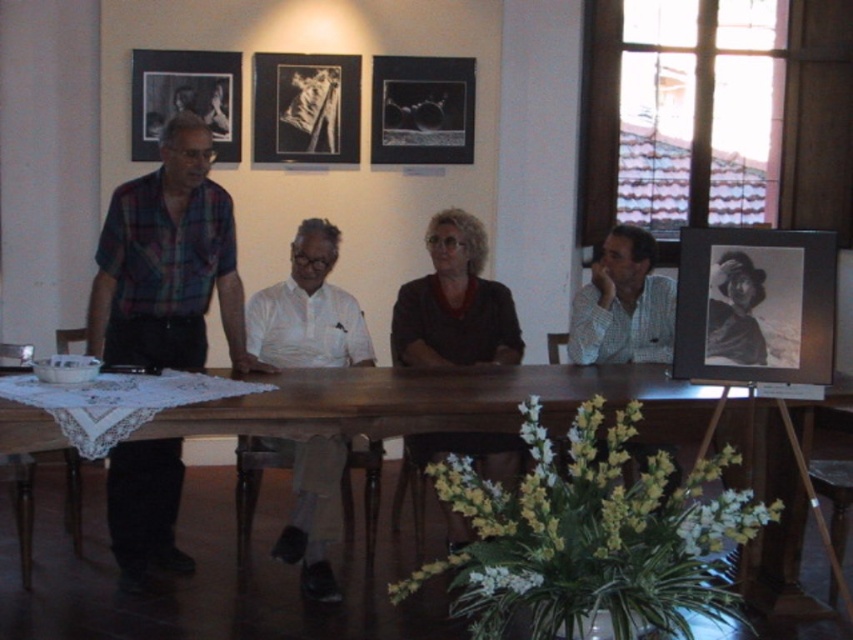
Does checkered fabric shirt at right have a smaller size compared to black matte picture frame at upper left?

Incorrect, checkered fabric shirt at right is not smaller in size than black matte picture frame at upper left.

Is checkered fabric shirt at right positioned behind black matte picture frame at upper left?

No, it is not.

What do you see at coordinates (624, 305) in the screenshot? The width and height of the screenshot is (853, 640). I see `checkered fabric shirt at right` at bounding box center [624, 305].

The image size is (853, 640). Find the location of `checkered fabric shirt at right`. checkered fabric shirt at right is located at coordinates (624, 305).

What do you see at coordinates (440, 401) in the screenshot? The height and width of the screenshot is (640, 853). I see `wooden table at center` at bounding box center [440, 401].

Who is taller, wooden table at center or checkered fabric shirt at right?

wooden table at center

Between point (403, 422) and point (630, 298), which one is positioned in front?

Point (403, 422) is more forward.

You are a GUI agent. You are given a task and a screenshot of the screen. Output one action in this format:
    pyautogui.click(x=<x>, y=<y>)
    Task: Click on the wooden table at center
    This screenshot has width=853, height=640.
    Given the screenshot: What is the action you would take?
    pyautogui.click(x=440, y=401)

Is white cotton shirt at center further to the viewer compared to black glossy picture frame at upper center?

No, it is in front of black glossy picture frame at upper center.

Is point (370, 348) closer to camera compared to point (381, 84)?

Yes, point (370, 348) is in front of point (381, 84).

Locate an element on the screen. The width and height of the screenshot is (853, 640). white cotton shirt at center is located at coordinates (308, 308).